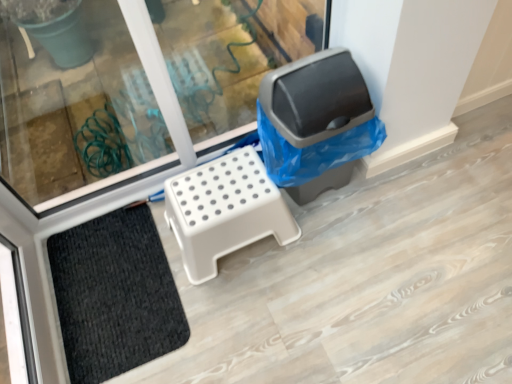
Question: Is gray plastic recycling bin at right facing towards white plastic step stool at center?

Choices:
 (A) yes
 (B) no

Answer: (B)

Question: Considering the relative sizes of gray plastic recycling bin at right and white plastic step stool at center in the image provided, is gray plastic recycling bin at right bigger than white plastic step stool at center?

Choices:
 (A) yes
 (B) no

Answer: (A)

Question: Can you confirm if gray plastic recycling bin at right is shorter than white plastic step stool at center?

Choices:
 (A) no
 (B) yes

Answer: (A)

Question: Considering the relative positions of gray plastic recycling bin at right and white plastic step stool at center in the image provided, is gray plastic recycling bin at right behind white plastic step stool at center?

Choices:
 (A) no
 (B) yes

Answer: (A)

Question: Is gray plastic recycling bin at right positioned with its back to white plastic step stool at center?

Choices:
 (A) yes
 (B) no

Answer: (B)

Question: Considering the positions of white plastic step stool at center and black textured mat at lower left in the image, is white plastic step stool at center taller or shorter than black textured mat at lower left?

Choices:
 (A) tall
 (B) short

Answer: (A)

Question: Is white plastic step stool at center to the left or to the right of black textured mat at lower left in the image?

Choices:
 (A) left
 (B) right

Answer: (B)

Question: Based on their sizes in the image, would you say white plastic step stool at center is bigger or smaller than black textured mat at lower left?

Choices:
 (A) big
 (B) small

Answer: (A)

Question: From the image's perspective, relative to black textured mat at lower left, is white plastic step stool at center above or below?

Choices:
 (A) above
 (B) below

Answer: (A)

Question: Looking at their shapes, would you say black textured mat at lower left is wider or thinner than gray plastic recycling bin at right?

Choices:
 (A) thin
 (B) wide

Answer: (B)

Question: From the image's perspective, is black textured mat at lower left positioned above or below gray plastic recycling bin at right?

Choices:
 (A) below
 (B) above

Answer: (A)

Question: In the image, is black textured mat at lower left positioned in front of or behind gray plastic recycling bin at right?

Choices:
 (A) behind
 (B) front

Answer: (A)

Question: Considering the positions of point (91, 345) and point (348, 69), is point (91, 345) closer or farther from the camera than point (348, 69)?

Choices:
 (A) farther
 (B) closer

Answer: (A)

Question: Considering the positions of white plastic step stool at center and gray plastic recycling bin at right in the image, is white plastic step stool at center taller or shorter than gray plastic recycling bin at right?

Choices:
 (A) tall
 (B) short

Answer: (B)

Question: Considering the relative positions of white plastic step stool at center and gray plastic recycling bin at right in the image provided, is white plastic step stool at center to the left or to the right of gray plastic recycling bin at right?

Choices:
 (A) right
 (B) left

Answer: (B)